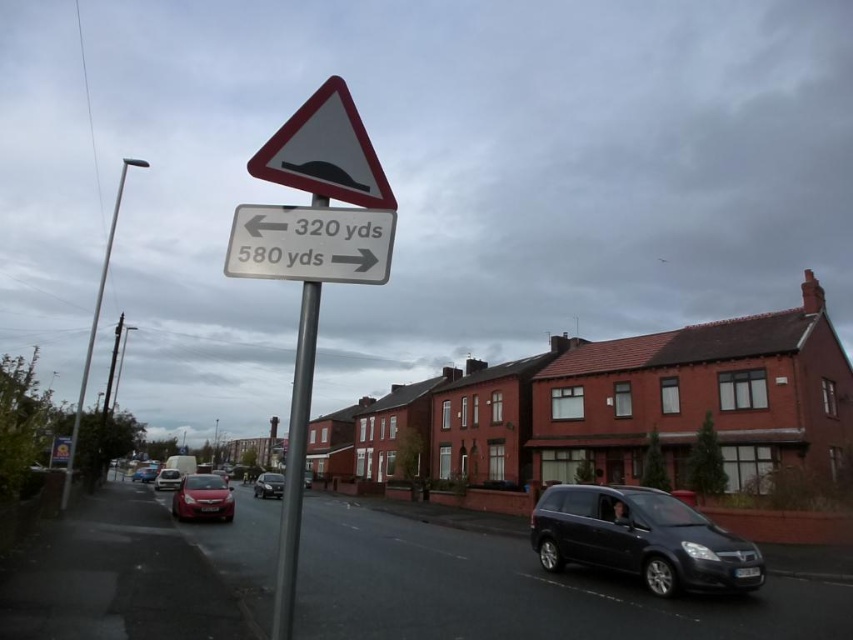
You are driving a delivery truck and need to pass between the matte black van at center and the shiny black car at center on the road. Which side should you steer towards to avoid hitting either vehicle?

You should steer towards the left side of the shiny black car at center because the matte black van at center is positioned on the right side of it, creating space on the left for the delivery truck to pass safely.

You are a pedestrian standing on the sidewalk and see the matte black van at center and the silver metallic pole at left. Which object is nearer to you?

The matte black van at center is closer to the viewer than the silver metallic pole at left.